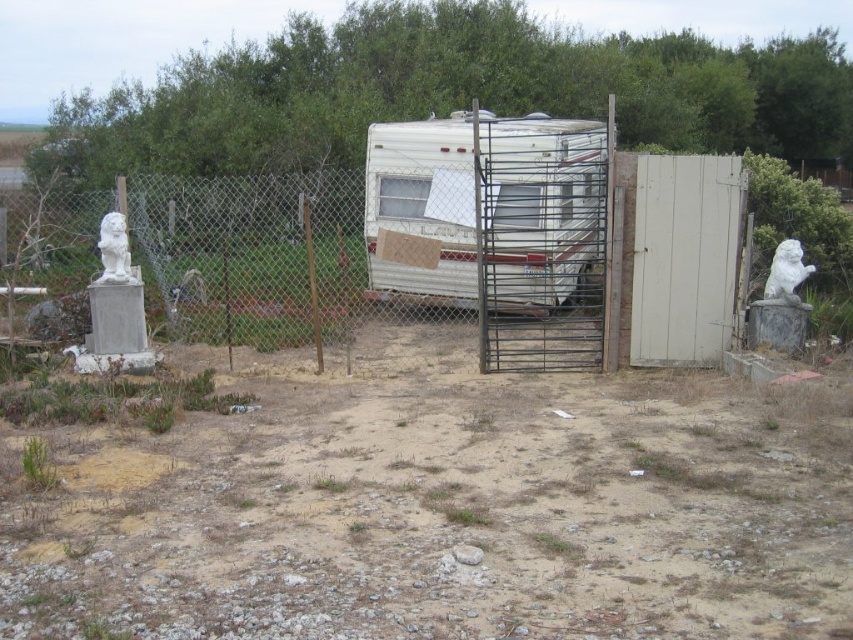
You are standing at the point marked as point (x=445, y=509) in the image. What is the color of the ground beneath your feet?

The point (x=445, y=509) is on dull brown dirt at center, so the ground beneath your feet is dull brown.